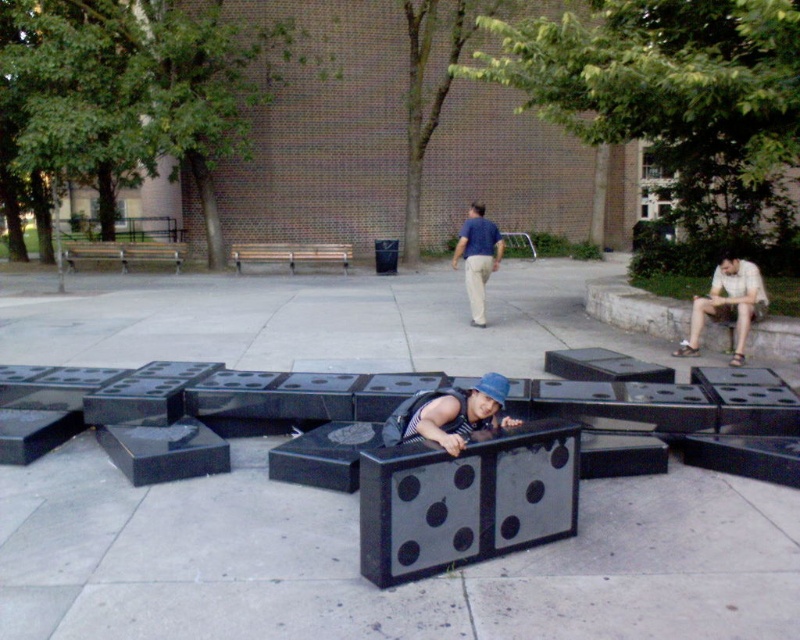
Question: Which object appears farthest from the camera in this image?

Choices:
 (A) matte blue shirt at center
 (B) light beige sandal at right
 (C) wooden bench at center
 (D) wooden bench at left

Answer: (D)

Question: Which point is farther to the camera?

Choices:
 (A) wooden bench at left
 (B) wooden bench at center
 (C) matte blue hat at center

Answer: (A)

Question: Where is matte blue hat at center located in relation to wooden bench at center in the image?

Choices:
 (A) right
 (B) left

Answer: (A)

Question: Observing the image, what is the correct spatial positioning of matte blue shirt at center in reference to wooden bench at center?

Choices:
 (A) left
 (B) right

Answer: (B)

Question: Among these objects, which one is farthest from the camera?

Choices:
 (A) wooden bench at left
 (B) black glossy blocks at center
 (C) matte blue hat at center
 (D) matte blue shirt at center

Answer: (A)

Question: Does matte blue hat at center lie behind light beige sandal at right?

Choices:
 (A) no
 (B) yes

Answer: (A)